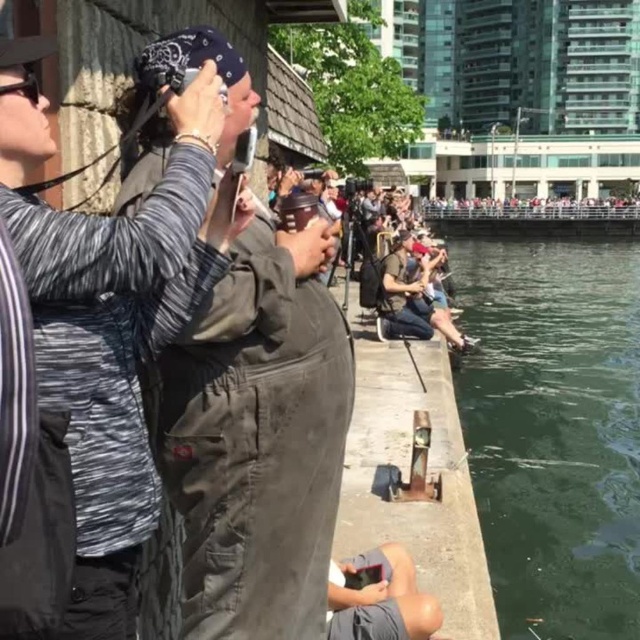
Can you confirm if gray fabric shorts at lower center is positioned to the left of matte gray jacket at center?

Indeed, gray fabric shorts at lower center is positioned on the left side of matte gray jacket at center.

Find the location of a particular element. This screenshot has width=640, height=640. gray fabric shorts at lower center is located at coordinates (380, 600).

Who is more distant from viewer, (328, 609) or (436, 257)?

Point (436, 257)

The image size is (640, 640). Identify the location of gray fabric shorts at lower center. (380, 600).

Is point (156, 420) more distant than point (355, 592)?

That is False.

Locate an element on the screen. Image resolution: width=640 pixels, height=640 pixels. dark gray fabric at center is located at coordinates (257, 438).

Is dark gray fabric at center above matte gray jacket at center?

No, dark gray fabric at center is not above matte gray jacket at center.

Consider the image. Can you confirm if dark gray fabric at center is positioned below matte gray jacket at center?

Correct, dark gray fabric at center is located below matte gray jacket at center.

This screenshot has width=640, height=640. In order to click on dark gray fabric at center in this screenshot , I will do point(257,438).